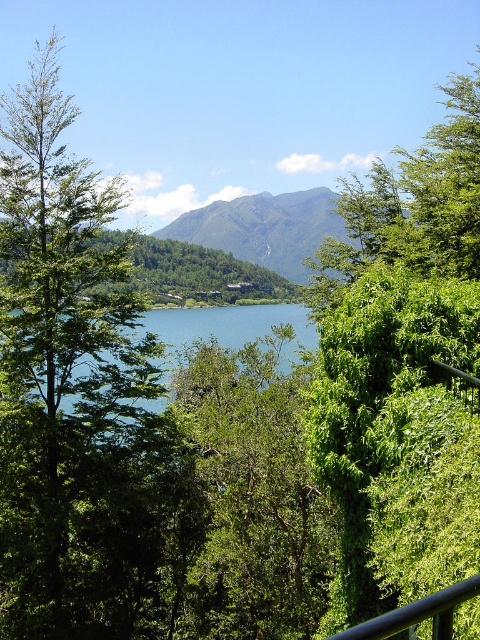
Question: Which point is farther to the camera?

Choices:
 (A) green leafy tree at left
 (B) green leafy tree at right

Answer: (A)

Question: Which is farther from the green leafy tree at left?

Choices:
 (A) black metal rail at lower right
 (B) green leafy tree at center
 (C) green leafy tree at right

Answer: (A)

Question: Is green leafy tree at left smaller than black metal rail at lower right?

Choices:
 (A) no
 (B) yes

Answer: (A)

Question: Is green leafy tree at center wider than black metal rail at lower right?

Choices:
 (A) yes
 (B) no

Answer: (A)

Question: Which object appears farthest from the camera in this image?

Choices:
 (A) green leafy tree at right
 (B) green leafy tree at center
 (C) black metal rail at lower right

Answer: (B)

Question: In this image, where is green leafy tree at right located relative to black metal rail at lower right?

Choices:
 (A) left
 (B) right

Answer: (B)